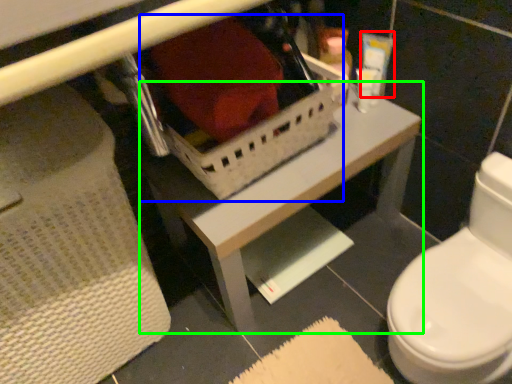
Question: Considering the real-world distances, which object is farthest from toiletry (highlighted by a red box)? storage box (highlighted by a blue box) or table (highlighted by a green box)?

Choices:
 (A) storage box
 (B) table

Answer: (B)